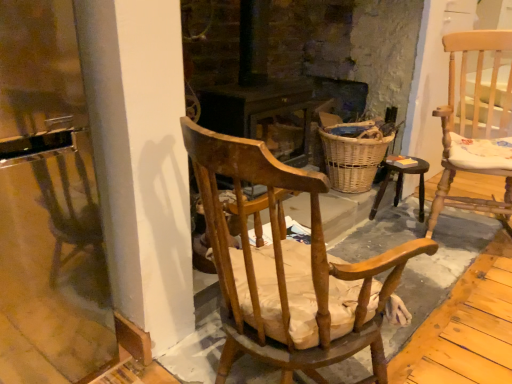
Question: Should I look upward or downward to see woven wicker basket at center?

Choices:
 (A) up
 (B) down

Answer: (A)

Question: Would you say wooden chair with cushion at center, which is the second chair in right-to-left order, is outside light wood cushioned chair at right, the first chair from the back?

Choices:
 (A) no
 (B) yes

Answer: (B)

Question: Does wooden chair with cushion at center, positioned as the 1th chair in front-to-back order, have a smaller size compared to light wood cushioned chair at right, the second chair viewed from the front?

Choices:
 (A) yes
 (B) no

Answer: (A)

Question: Considering the relative positions of wooden chair with cushion at center, which appears as the second chair when viewed from the back, and light wood cushioned chair at right, the 2th chair viewed from the left, in the image provided, is wooden chair with cushion at center, which appears as the second chair when viewed from the back, to the left of light wood cushioned chair at right, the 2th chair viewed from the left, from the viewer's perspective?

Choices:
 (A) yes
 (B) no

Answer: (A)

Question: Considering the relative sizes of wooden chair with cushion at center, positioned as the 1th chair in front-to-back order, and light wood cushioned chair at right, the second chair viewed from the front, in the image provided, is wooden chair with cushion at center, positioned as the 1th chair in front-to-back order, bigger than light wood cushioned chair at right, the second chair viewed from the front,?

Choices:
 (A) yes
 (B) no

Answer: (B)

Question: Is the position of wooden chair with cushion at center, which appears as the second chair when viewed from the back, more distant than that of light wood cushioned chair at right, the first chair from the back?

Choices:
 (A) no
 (B) yes

Answer: (A)

Question: Could you tell me if wooden chair with cushion at center, the first chair viewed from the left, is turned towards light wood cushioned chair at right, the 2th chair viewed from the left?

Choices:
 (A) no
 (B) yes

Answer: (B)

Question: Considering the relative sizes of light wood cushioned chair at right, the 2th chair viewed from the left, and wooden chair with cushion at center, which is the second chair in right-to-left order, in the image provided, is light wood cushioned chair at right, the 2th chair viewed from the left, smaller than wooden chair with cushion at center, which is the second chair in right-to-left order,?

Choices:
 (A) yes
 (B) no

Answer: (B)

Question: From a real-world perspective, is light wood cushioned chair at right, the 2th chair viewed from the left, on wooden chair with cushion at center, which appears as the second chair when viewed from the back?

Choices:
 (A) yes
 (B) no

Answer: (A)

Question: From a real-world perspective, is light wood cushioned chair at right, the first chair from the back, under wooden chair with cushion at center, which appears as the second chair when viewed from the back?

Choices:
 (A) yes
 (B) no

Answer: (B)

Question: Is light wood cushioned chair at right, arranged as the 1th chair when viewed from the right, bigger than wooden chair with cushion at center, which is the second chair in right-to-left order?

Choices:
 (A) yes
 (B) no

Answer: (A)

Question: Considering the relative positions of light wood cushioned chair at right, the first chair from the back, and wooden chair with cushion at center, the first chair viewed from the left, in the image provided, is light wood cushioned chair at right, the first chair from the back, to the left of wooden chair with cushion at center, the first chair viewed from the left, from the viewer's perspective?

Choices:
 (A) no
 (B) yes

Answer: (A)

Question: Considering the relative positions of light wood cushioned chair at right, arranged as the 1th chair when viewed from the right, and wooden chair with cushion at center, which is the second chair in right-to-left order, in the image provided, is light wood cushioned chair at right, arranged as the 1th chair when viewed from the right, in front of wooden chair with cushion at center, which is the second chair in right-to-left order,?

Choices:
 (A) yes
 (B) no

Answer: (B)

Question: Is wooden chair with cushion at center, which is the second chair in right-to-left order, outside of wooden stool at center?

Choices:
 (A) yes
 (B) no

Answer: (A)